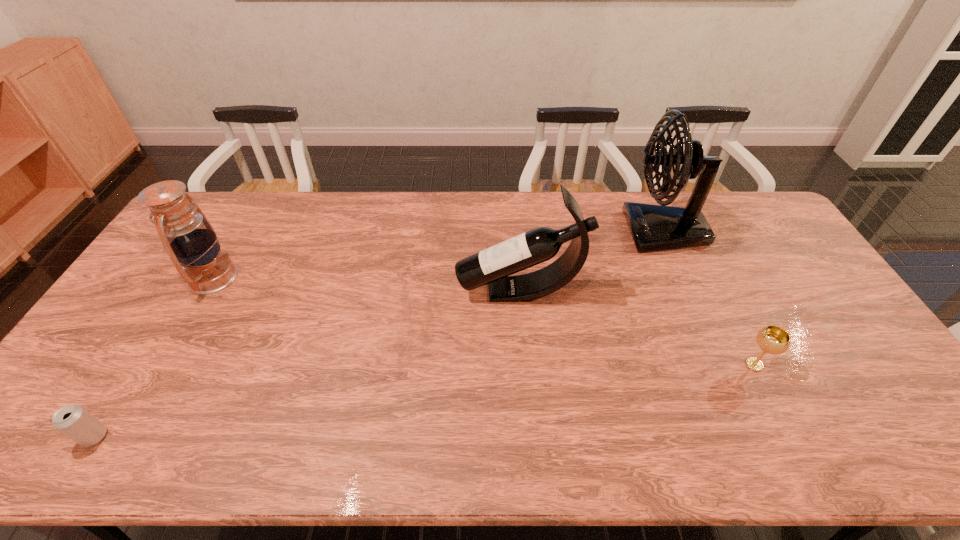
Where is `vacant point located between the fan and the nearest object`? This screenshot has width=960, height=540. vacant point located between the fan and the nearest object is located at coordinates (379, 334).

The width and height of the screenshot is (960, 540). Find the location of `free space between the wine bottle and the shortest object`. free space between the wine bottle and the shortest object is located at coordinates (307, 364).

This screenshot has height=540, width=960. I want to click on free spot between the tallest object and the oil lamp, so click(x=438, y=254).

The image size is (960, 540). I want to click on free space between the shortest object and the second shortest object, so click(424, 401).

Choose which object is the fourth nearest neighbor to the oil lamp. Please provide its 2D coordinates. Your answer should be formatted as a tuple, i.e. [(x, y)], where the tuple contains the x and y coordinates of a point satisfying the conditions above.

[(772, 339)]

At what (x,y) coordinates should I click in order to perform the action: click on object that is the fourth closest to the oil lamp. Please return your answer as a coordinate pair (x, y). Looking at the image, I should click on (772, 339).

Find the location of a particular element. vacant point that satisfies the following two spatial constraints: 1. in front of the second shortest object to blow air; 2. on the right side of the fan is located at coordinates (723, 364).

Where is `vacant point that satisfies the following two spatial constraints: 1. on the back side of the chalice; 2. on the stand of the wine bottle`? This screenshot has height=540, width=960. vacant point that satisfies the following two spatial constraints: 1. on the back side of the chalice; 2. on the stand of the wine bottle is located at coordinates (717, 291).

Find the location of a particular element. free space in the image that satisfies the following two spatial constraints: 1. in front of the fan to blow air; 2. on the front side of the oil lamp is located at coordinates (684, 277).

This screenshot has height=540, width=960. I want to click on blank area in the image that satisfies the following two spatial constraints: 1. on the stand of the wine bottle; 2. on the front side of the nearest object, so click(532, 436).